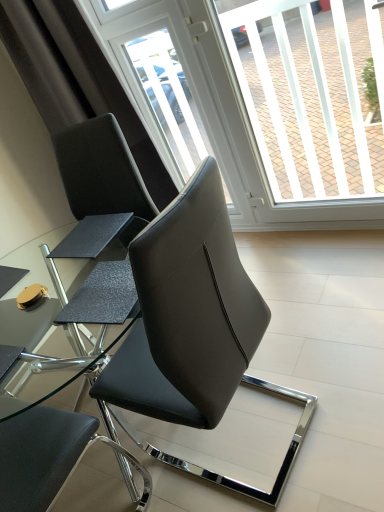
The width and height of the screenshot is (384, 512). I want to click on free point below transparent glass window screen at upper center (from a real-world perspective), so click(325, 233).